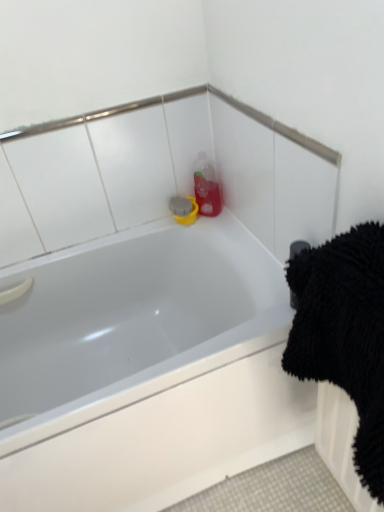
Where is `vacant space behind black rubber towel bar at upper right`? Image resolution: width=384 pixels, height=512 pixels. vacant space behind black rubber towel bar at upper right is located at coordinates (266, 276).